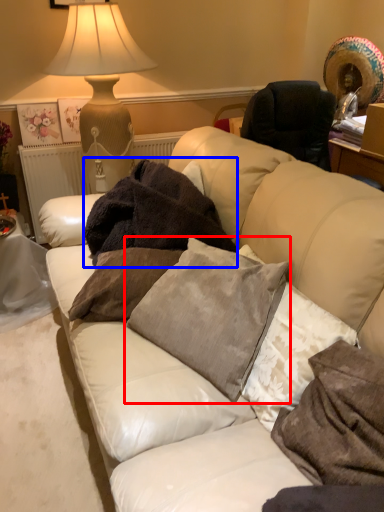
Question: Which object is closer to the camera taking this photo, pillow (highlighted by a red box) or blanket (highlighted by a blue box)?

Choices:
 (A) pillow
 (B) blanket

Answer: (A)